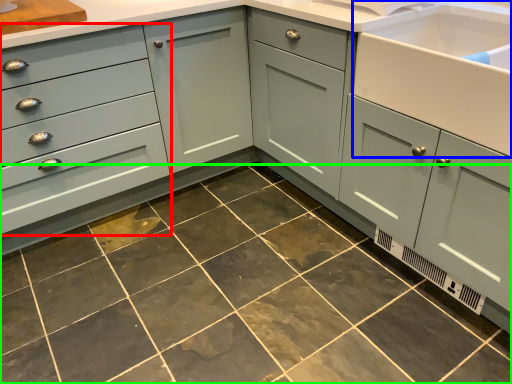
Question: Estimate the real-world distances between objects in this image. Which object is farther from drawer (highlighted by a red box), sink (highlighted by a blue box) or ceramic tile (highlighted by a green box)?

Choices:
 (A) sink
 (B) ceramic tile

Answer: (A)